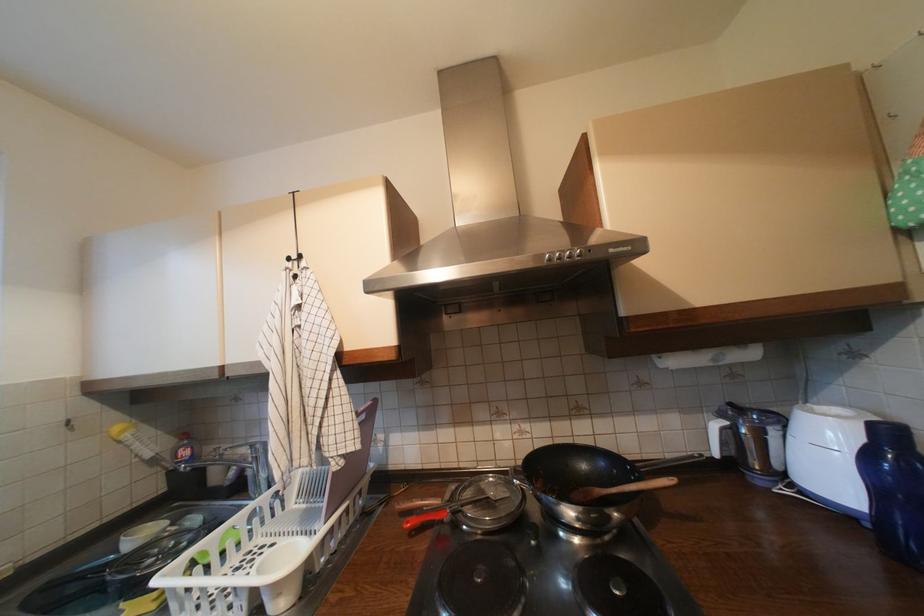
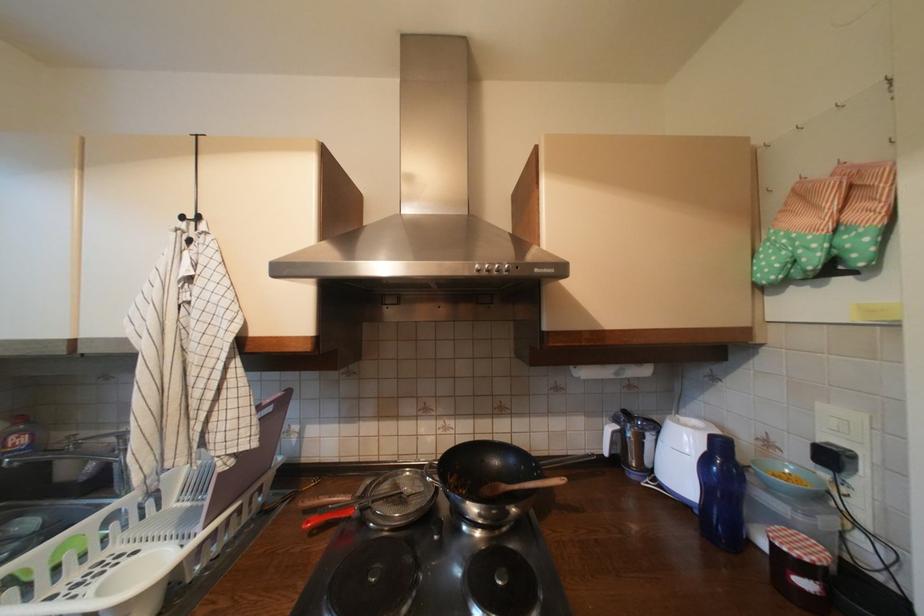
Locate, in the second image, the point that corresponds to point (496, 499) in the first image.

(410, 495)